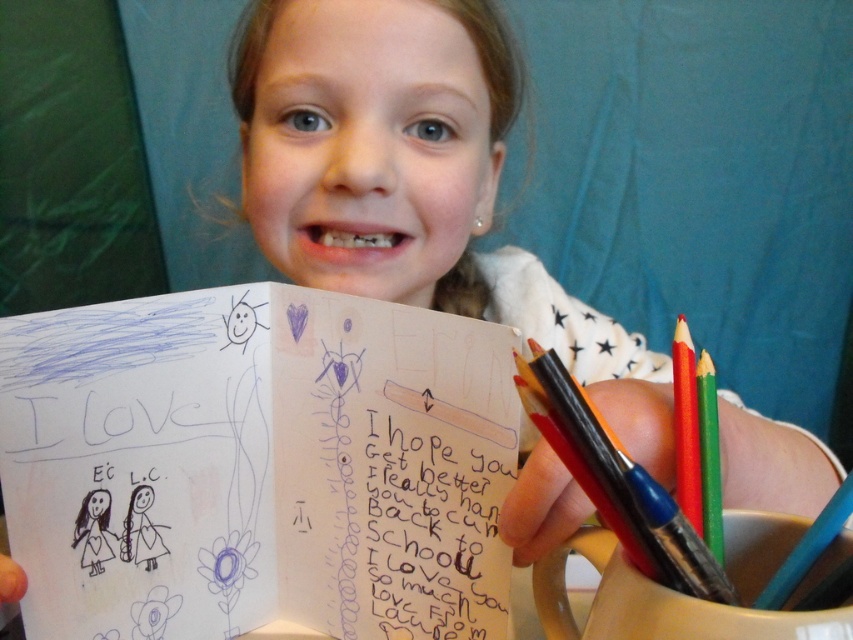
The girl is holding a handwritten paper at center and a green matte crayon at right. If the distance between them is 9.70 centimeters, can she reach both items at the same time with her hands without moving her arms?

The handwritten paper at center is 9.70 centimeters from green matte crayon at right. Since the average adult hand span is about 20 cm, and the distance between them is less than that, she can easily reach both items at the same time without moving her arms.

The girl is holding a card with two pencils nearby. Which pencil is positioned lower between the matte black pencil at right and the red matte pencil at right?

The matte black pencil at right is positioned lower than the red matte pencil at right.

The girl is holding a card with two drawing tools on her desk. You need to place a new drawing tool between the red matte pencil at right and the green matte crayon at right. According to their positions, which tool should be placed closer to the left side?

The red matte pencil at right is positioned on the left side of the green matte crayon at right, so the new drawing tool should be placed closer to the red matte pencil at right to maintain the order.